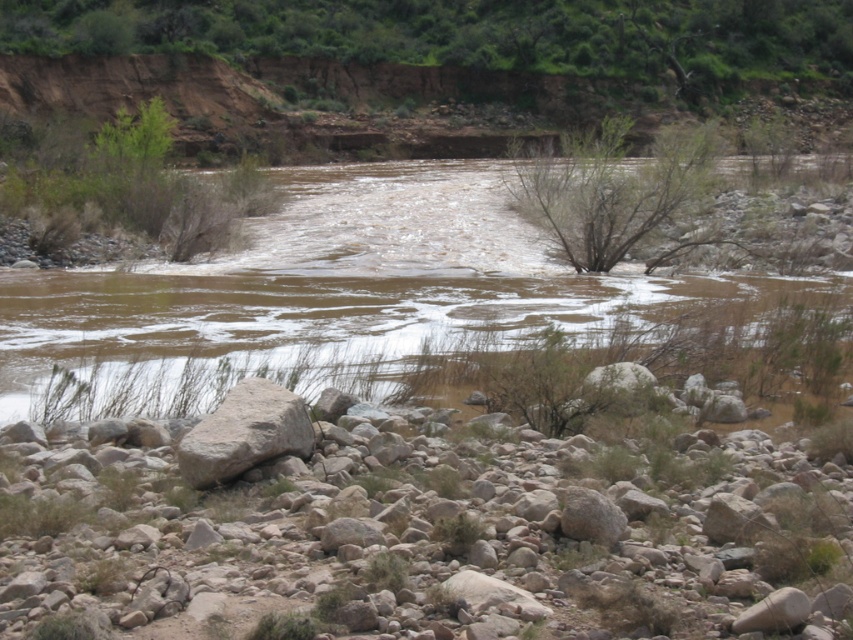
You are a hiker trying to cross the river using the rocks as stepping stones. You see the gray rock at lower center and the gray rough rock at lower left. Which rock should you step on first to start your crossing?

You should step on the gray rough rock at lower left first because the gray rock at lower center is positioned under it, meaning the gray rough rock at lower left is closer to the starting point.

You are standing at the edge of the river and need to cross to the other side. You see a gray rock at lower center and a brown muddy stream at center. Which object is located to the right of the stream?

The gray rock at lower center is positioned on the right side of the brown muddy stream at center.